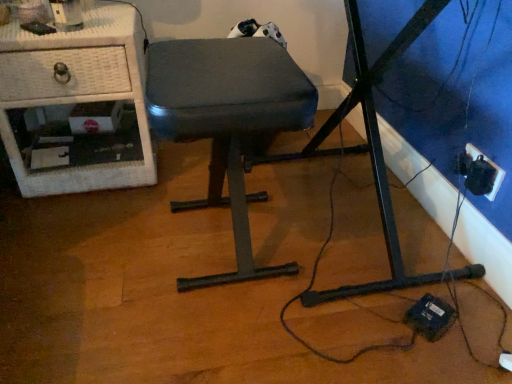
At what (x,y) coordinates should I click in order to perform the action: click on free spot below dark gray fabric stool at center (from a real-world perspective). Please return your answer as a coordinate pair (x, y). The image size is (512, 384). Looking at the image, I should click on (214, 249).